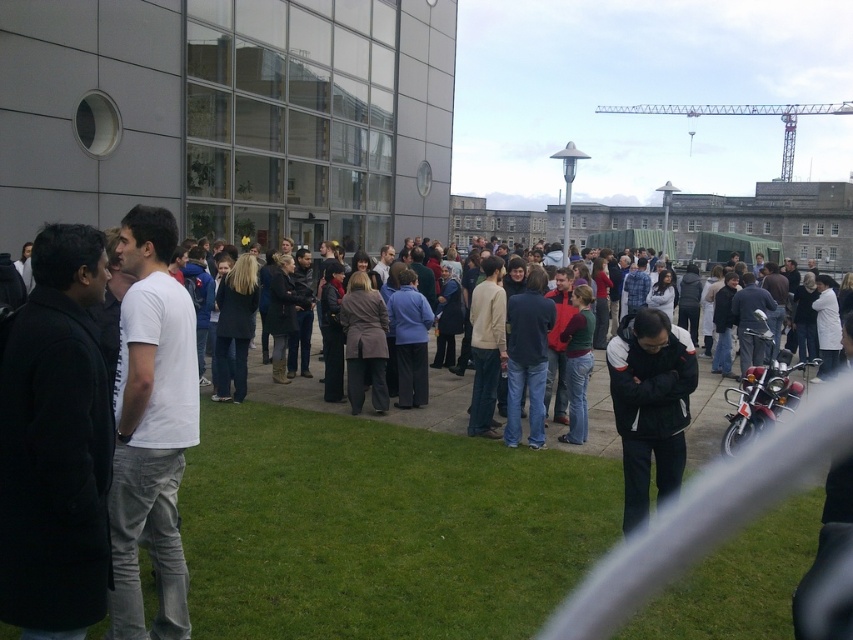
You are standing at the point marked by the coordinates (381, 529) in the image. What type of surface are you currently standing on?

The green grass at lower center is located at point (381, 529), so you are standing on green grass at lower center.